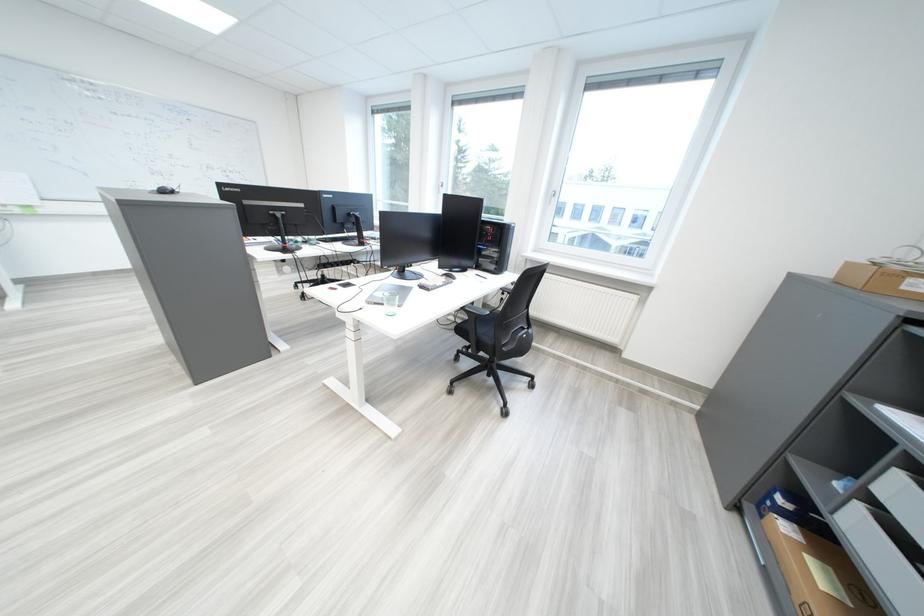
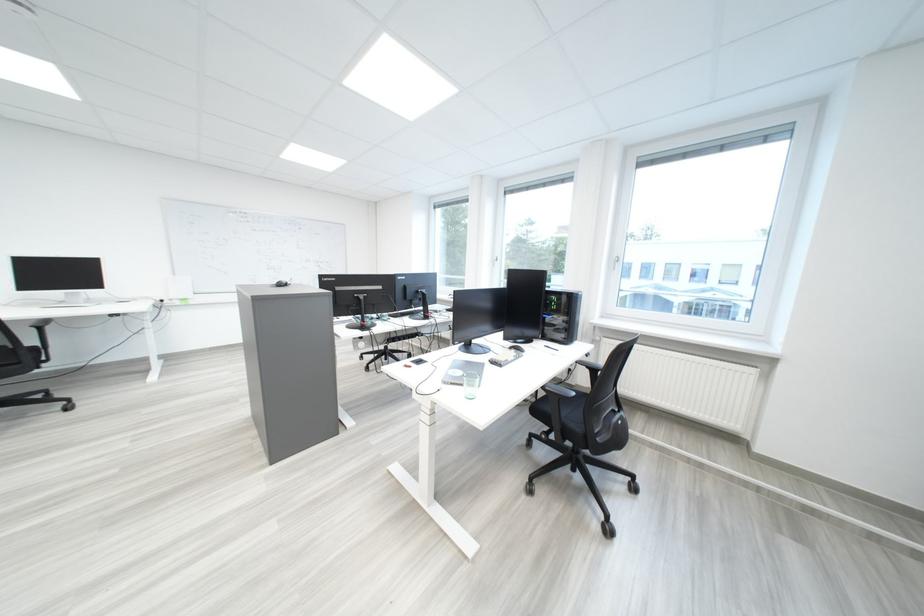
Where in the second image is the point corresponding to (x=388, y=305) from the first image?

(465, 386)